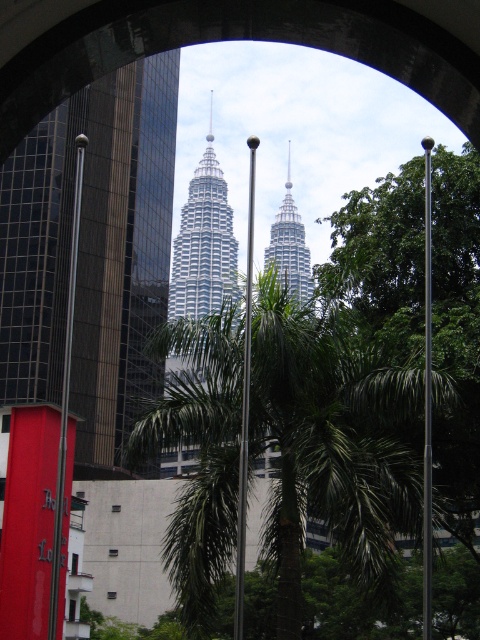
Does polished metal pole at center appear on the left side of silver metallic twin towers at center?

Incorrect, polished metal pole at center is not on the left side of silver metallic twin towers at center.

Is point (425, 417) farther from viewer compared to point (276, 266)?

No, (425, 417) is closer to viewer.

What are the coordinates of `polished metal pole at center` in the screenshot? It's located at (428, 401).

Can you confirm if polished silver pole at left is smaller than polished metal pole at center?

Incorrect, polished silver pole at left is not smaller in size than polished metal pole at center.

What do you see at coordinates (66, 392) in the screenshot? This screenshot has width=480, height=640. I see `polished silver pole at left` at bounding box center [66, 392].

Find the location of a particular element. Image resolution: width=480 pixels, height=640 pixels. polished silver pole at left is located at coordinates [x=66, y=392].

The height and width of the screenshot is (640, 480). In order to click on polished silver pole at left in this screenshot , I will do `click(66, 392)`.

Does glassy reflective skyscraper at left have a greater width compared to green leafy palm tree at center?

Indeed, glassy reflective skyscraper at left has a greater width compared to green leafy palm tree at center.

Can you confirm if glassy reflective skyscraper at left is bigger than green leafy palm tree at center?

Yes.

This screenshot has width=480, height=640. I want to click on glassy reflective skyscraper at left, so click(92, 253).